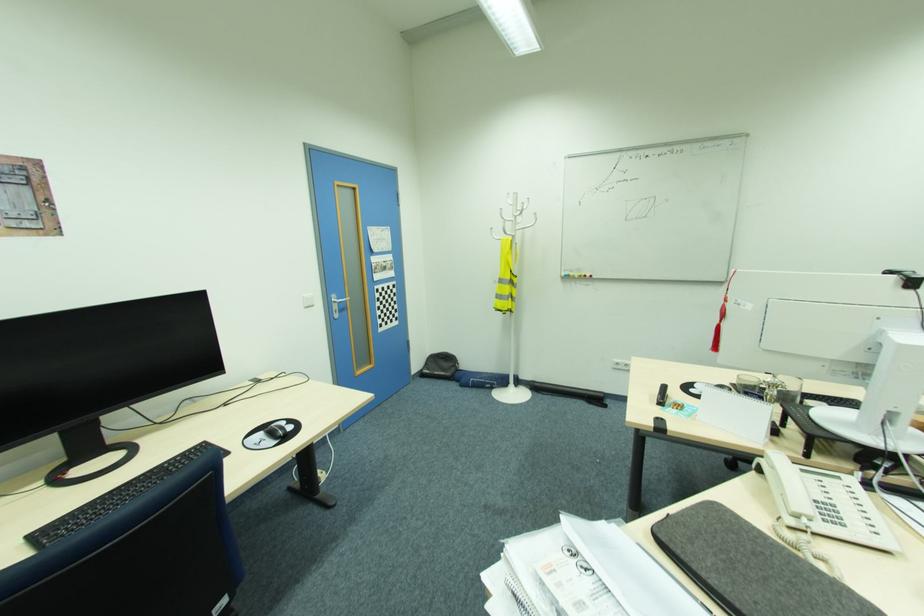
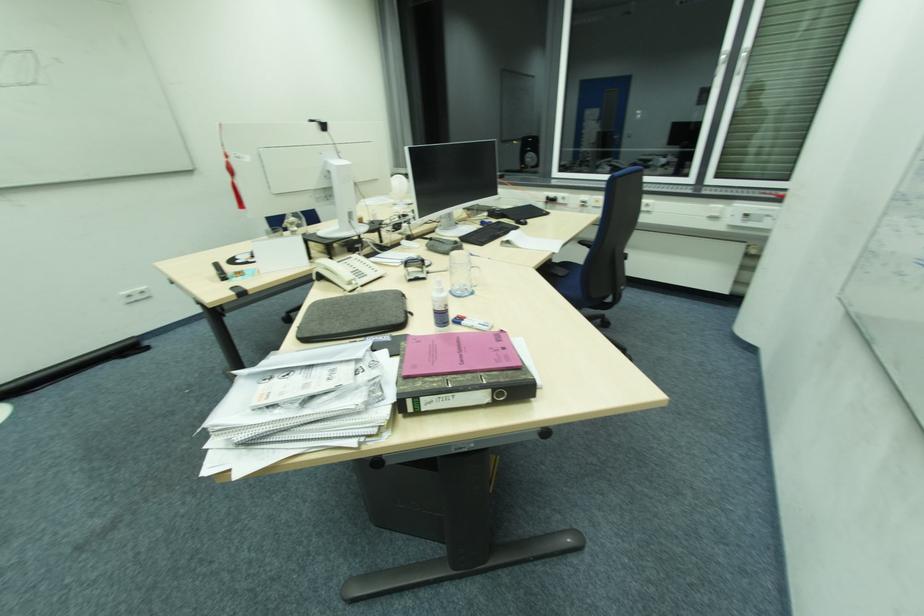
In the second image, find the point that corresponds to (807,471) in the first image.

(342, 262)